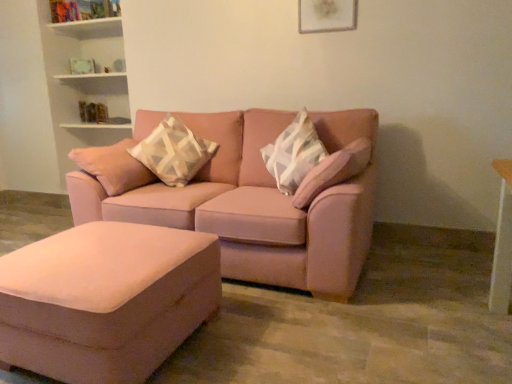
Question: Considering the relative positions of matte white picture frame at upper center and suede ottoman at lower left in the image provided, is matte white picture frame at upper center to the left of suede ottoman at lower left from the viewer's perspective?

Choices:
 (A) no
 (B) yes

Answer: (A)

Question: Is matte white picture frame at upper center surrounding suede ottoman at lower left?

Choices:
 (A) yes
 (B) no

Answer: (B)

Question: Are matte white picture frame at upper center and suede ottoman at lower left beside each other?

Choices:
 (A) yes
 (B) no

Answer: (B)

Question: Is matte white picture frame at upper center positioned with its back to suede ottoman at lower left?

Choices:
 (A) yes
 (B) no

Answer: (B)

Question: Can we say matte white picture frame at upper center lies outside suede ottoman at lower left?

Choices:
 (A) no
 (B) yes

Answer: (B)

Question: Is matte white picture frame at upper center aimed at suede ottoman at lower left?

Choices:
 (A) no
 (B) yes

Answer: (A)

Question: Is geometric-patterned fabric pillow at center at the right side of suede ottoman at lower left?

Choices:
 (A) yes
 (B) no

Answer: (A)

Question: Is geometric-patterned fabric pillow at center directly adjacent to suede ottoman at lower left?

Choices:
 (A) yes
 (B) no

Answer: (B)

Question: Is suede ottoman at lower left at the back of geometric-patterned fabric pillow at center?

Choices:
 (A) no
 (B) yes

Answer: (A)

Question: From a real-world perspective, is geometric-patterned fabric pillow at center positioned under suede ottoman at lower left based on gravity?

Choices:
 (A) no
 (B) yes

Answer: (A)

Question: Considering the relative sizes of geometric-patterned fabric pillow at center and suede ottoman at lower left in the image provided, is geometric-patterned fabric pillow at center smaller than suede ottoman at lower left?

Choices:
 (A) yes
 (B) no

Answer: (A)

Question: Would you say geometric-patterned fabric pillow at center is a long distance from suede ottoman at lower left?

Choices:
 (A) yes
 (B) no

Answer: (A)

Question: Is there a large distance between geometric-patterned fabric pillow at center and matte white picture frame at upper center?

Choices:
 (A) yes
 (B) no

Answer: (A)